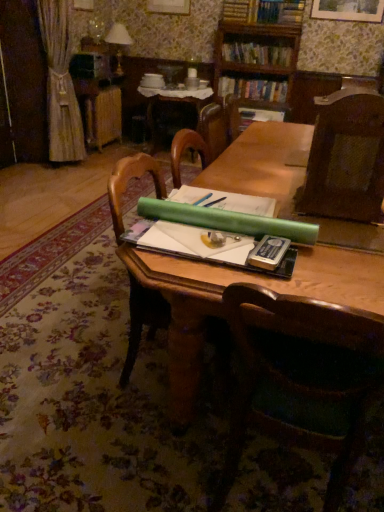
Find the location of a particular element. This screenshot has width=384, height=512. free space in front of brown textured chair at right, the first chair from the top is located at coordinates (346, 236).